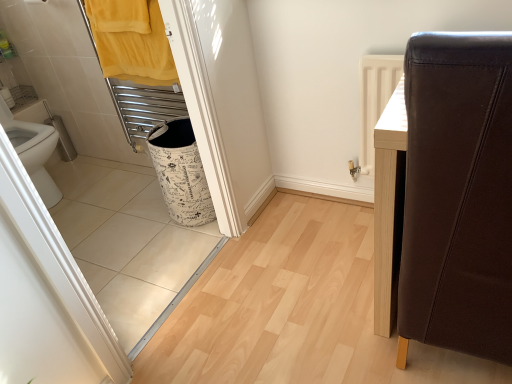
What is the approximate height of white printed fabric laundry basket at lower left?

18.29 inches.

The image size is (512, 384). Find the location of `white printed fabric laundry basket at lower left`. white printed fabric laundry basket at lower left is located at coordinates (180, 172).

Describe the element at coordinates (458, 195) in the screenshot. I see `brown leather chair at right` at that location.

What are the coordinates of `yellow fabric towel at upper left` in the screenshot? It's located at (132, 41).

Is brown leather chair at right looking in the opposite direction of yellow fabric towel at upper left?

brown leather chair at right is not turned away from yellow fabric towel at upper left.

How many degrees apart are the facing directions of brown leather chair at right and yellow fabric towel at upper left?

brown leather chair at right and yellow fabric towel at upper left are facing 179 degrees away from each other.

Are brown leather chair at right and yellow fabric towel at upper left located far from each other?

Yes, brown leather chair at right and yellow fabric towel at upper left are quite far apart.

Is point (504, 314) positioned before point (130, 13)?

Yes, it is.

Can you tell me how much white printed fabric laundry basket at lower left and brown leather chair at right differ in facing direction?

white printed fabric laundry basket at lower left and brown leather chair at right are facing 179 degrees away from each other.

Is white printed fabric laundry basket at lower left not near brown leather chair at right?

Absolutely, white printed fabric laundry basket at lower left is distant from brown leather chair at right.

Considering the sizes of objects white printed fabric laundry basket at lower left and brown leather chair at right in the image provided, who is shorter, white printed fabric laundry basket at lower left or brown leather chair at right?

white printed fabric laundry basket at lower left is shorter.

How far apart are brown leather chair at right and white printed fabric laundry basket at lower left?

brown leather chair at right is 1.12 meters from white printed fabric laundry basket at lower left.

From the image's perspective, does brown leather chair at right appear lower than white printed fabric laundry basket at lower left?

Yes.

Are brown leather chair at right and white printed fabric laundry basket at lower left beside each other?

brown leather chair at right and white printed fabric laundry basket at lower left are not in contact.

Can you confirm if brown leather chair at right is smaller than white printed fabric laundry basket at lower left?

Actually, brown leather chair at right might be larger than white printed fabric laundry basket at lower left.

From the image's perspective, is yellow fabric towel at upper left located beneath white printed fabric laundry basket at lower left?

Incorrect, from the image's perspective, yellow fabric towel at upper left is higher than white printed fabric laundry basket at lower left.

Considering the positions of points (167, 54) and (192, 150), is point (167, 54) farther from camera compared to point (192, 150)?

Yes, point (167, 54) is farther from viewer.

At what (x,y) coordinates should I click in order to perform the action: click on bath towel located in front of the white printed fabric laundry basket at lower left. Please return your answer as a coordinate pair (x, y). The height and width of the screenshot is (384, 512). Looking at the image, I should click on (132, 41).

Which is more to the left, yellow fabric towel at upper left or white printed fabric laundry basket at lower left?

yellow fabric towel at upper left.

Relative to brown leather chair at right, is yellow fabric towel at upper left in front or behind?

Visually, yellow fabric towel at upper left is located behind brown leather chair at right.

Looking at this image, from their relative heights in the image, would you say yellow fabric towel at upper left is taller or shorter than brown leather chair at right?

Considering their sizes, yellow fabric towel at upper left has less height than brown leather chair at right.

From a real-world perspective, who is located higher, yellow fabric towel at upper left or brown leather chair at right?

yellow fabric towel at upper left is physically above.

How far apart are yellow fabric towel at upper left and brown leather chair at right?

4.69 feet.

Looking at their sizes, would you say white printed fabric laundry basket at lower left is wider or thinner than yellow fabric towel at upper left?

Considering their sizes, white printed fabric laundry basket at lower left looks broader than yellow fabric towel at upper left.

Locate an element on the screen. The height and width of the screenshot is (384, 512). laundry basket on the right of yellow fabric towel at upper left is located at coordinates (180, 172).

Based on the photo, who is taller, white printed fabric laundry basket at lower left or yellow fabric towel at upper left?

With more height is white printed fabric laundry basket at lower left.

The height and width of the screenshot is (384, 512). I want to click on bath towel to the left of brown leather chair at right, so click(x=132, y=41).

The image size is (512, 384). I want to click on laundry basket behind the brown leather chair at right, so click(180, 172).

Considering their positions, is yellow fabric towel at upper left positioned closer to white printed fabric laundry basket at lower left than brown leather chair at right?

yellow fabric towel at upper left.

Looking at the image, which one is located closer to brown leather chair at right, white printed fabric laundry basket at lower left or yellow fabric towel at upper left?

white printed fabric laundry basket at lower left.

Which object lies further to the anchor point brown leather chair at right, yellow fabric towel at upper left or white printed fabric laundry basket at lower left?

The object further to brown leather chair at right is yellow fabric towel at upper left.

Considering their positions, is brown leather chair at right positioned closer to yellow fabric towel at upper left than white printed fabric laundry basket at lower left?

white printed fabric laundry basket at lower left is positioned closer to the anchor yellow fabric towel at upper left.

Based on their spatial positions, is brown leather chair at right or yellow fabric towel at upper left closer to white printed fabric laundry basket at lower left?

yellow fabric towel at upper left is closer to white printed fabric laundry basket at lower left.

From the image, which object appears to be nearer to yellow fabric towel at upper left, white printed fabric laundry basket at lower left or brown leather chair at right?

The object closer to yellow fabric towel at upper left is white printed fabric laundry basket at lower left.

Locate an element on the screen. The image size is (512, 384). bath towel between brown leather chair at right and white printed fabric laundry basket at lower left along the z-axis is located at coordinates (132, 41).